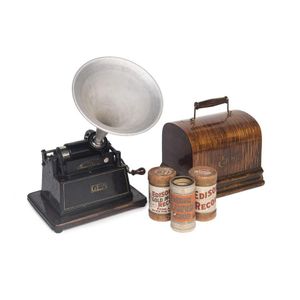
Where is `recorder stand`? recorder stand is located at coordinates (81, 219).